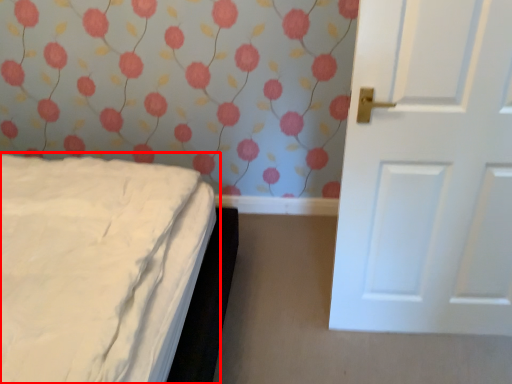
Question: From the image's perspective, what is the correct spatial relationship of bed (annotated by the red box) in relation to door?

Choices:
 (A) below
 (B) above

Answer: (A)